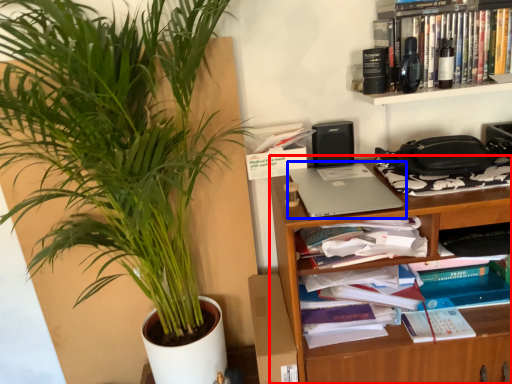
Question: Which object appears farthest to the camera in this image, shelf (highlighted by a red box) or laptop (highlighted by a blue box)?

Choices:
 (A) shelf
 (B) laptop

Answer: (B)